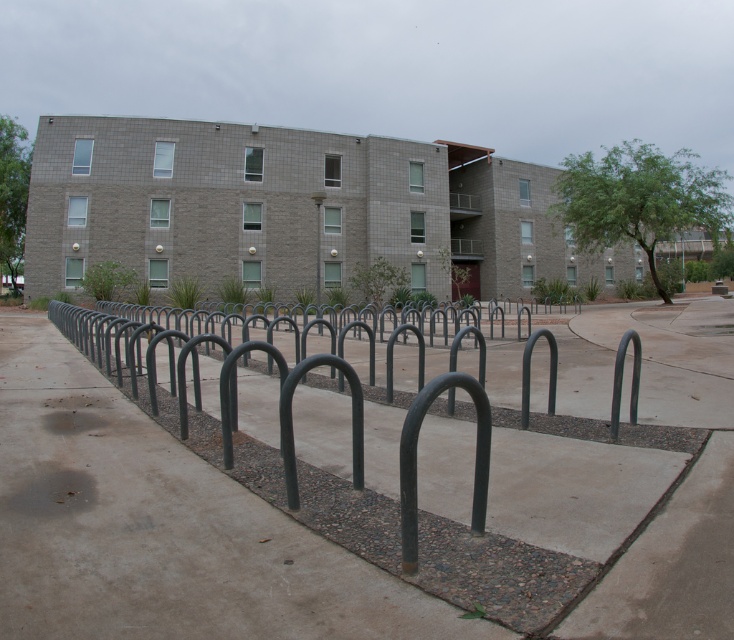
Question: Among these points, which one is farthest from the camera?

Choices:
 (A) (316, 195)
 (B) (266, 518)

Answer: (A)

Question: Is gray concrete pavement at center positioned in front of metallic pole at center?

Choices:
 (A) yes
 (B) no

Answer: (A)

Question: Does gray concrete pavement at center have a larger size compared to metallic pole at center?

Choices:
 (A) no
 (B) yes

Answer: (A)

Question: Which object appears farthest from the camera in this image?

Choices:
 (A) gray concrete pavement at center
 (B) metallic pole at center

Answer: (B)

Question: Which object is farther from the camera taking this photo?

Choices:
 (A) gray concrete pavement at center
 (B) metallic pole at center

Answer: (B)

Question: Does gray concrete pavement at center appear on the left side of metallic pole at center?

Choices:
 (A) no
 (B) yes

Answer: (A)